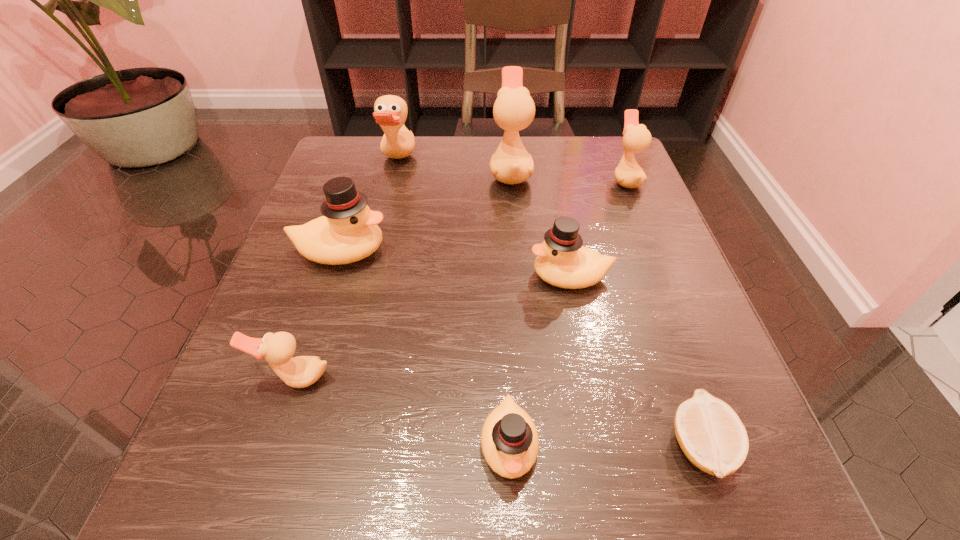
Identify the location of the smallest yellow duck. This screenshot has width=960, height=540. (509, 439).

This screenshot has height=540, width=960. In order to click on lemon in this screenshot , I will do `click(711, 435)`.

Identify the location of the shortest object. (711, 435).

Where is `vacant space located 0.060m on the beak of the third tan duck from left to right`? This screenshot has width=960, height=540. vacant space located 0.060m on the beak of the third tan duck from left to right is located at coordinates (463, 172).

In order to click on free region located on the beak of the third tan duck from left to right in this screenshot , I will do `click(330, 172)`.

Find the location of `vacant space located 0.150m on the beak of the third tan duck from left to right`. vacant space located 0.150m on the beak of the third tan duck from left to right is located at coordinates (423, 172).

At what (x,y) coordinates should I click in order to perform the action: click on vacant area situated on the beak of the second biggest tan duck. Please return your answer as a coordinate pair (x, y). The width and height of the screenshot is (960, 540). Looking at the image, I should click on (479, 161).

This screenshot has width=960, height=540. Identify the location of free spot located 0.300m on the front-facing side of the leftmost yellow duck. (552, 252).

Locate an element on the screen. The width and height of the screenshot is (960, 540). vacant space located on the beak of the rightmost tan duck is located at coordinates (580, 180).

Identify the location of vacant area situated 0.110m on the beak of the rightmost tan duck. The image size is (960, 540). (562, 180).